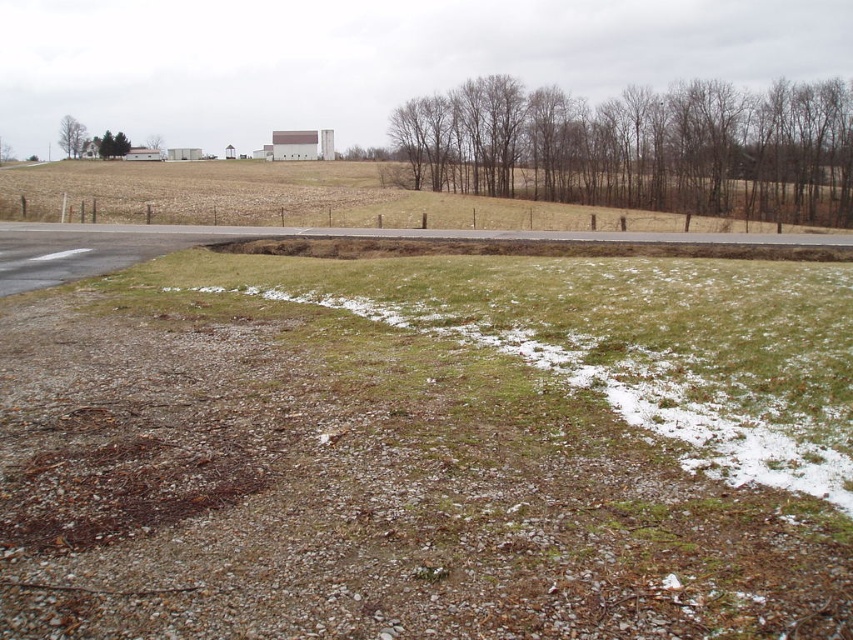
You are a hiker planning to cross the area shown in the image. You need to decide whether to walk on the green grassy field at upper center or the green leafy tree at upper left. Which area is larger and more suitable for walking?

The green grassy field at upper center is bigger than the green leafy tree at upper left, so it is more suitable for walking.

You are navigating a drone over the rural landscape shown. The drone must avoid flying near the bare wood trees at upper right. Given their position at point 0.231 on the x and 0.750 on the y axis, can you confirm if they are positioned in the upper right quadrant of the image?

The bare wood trees at upper right are located at coordinates 0.231 on the x and 0.750 on the y axis. Since the upper right quadrant typically spans from x values above 0.5 to the right edge and y values above 0.5 upwards, these coordinates place them in the upper middle area rather than the upper right quadrant. Therefore, the trees are not in the upper right quadrant but closer to the center right.